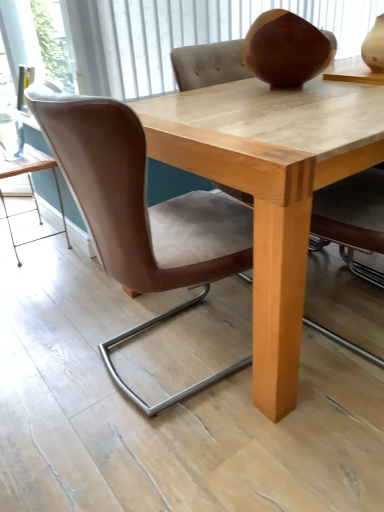
Question: Considering the relative sizes of brown leather chair at center and light brown wood table at lower left in the image provided, is brown leather chair at center thinner than light brown wood table at lower left?

Choices:
 (A) yes
 (B) no

Answer: (B)

Question: Could you tell me if brown leather chair at center is facing light brown wood table at lower left?

Choices:
 (A) yes
 (B) no

Answer: (B)

Question: Can you confirm if brown leather chair at center is shorter than light brown wood table at lower left?

Choices:
 (A) yes
 (B) no

Answer: (B)

Question: From a real-world perspective, is brown leather chair at center below light brown wood table at lower left?

Choices:
 (A) yes
 (B) no

Answer: (B)

Question: Does brown leather chair at center have a greater height compared to light brown wood table at lower left?

Choices:
 (A) yes
 (B) no

Answer: (A)

Question: Considering the positions of light brown wood table at lower left and transparent glass door at upper left in the image, is light brown wood table at lower left taller or shorter than transparent glass door at upper left?

Choices:
 (A) tall
 (B) short

Answer: (A)

Question: From a real-world perspective, relative to transparent glass door at upper left, is light brown wood table at lower left vertically above or below?

Choices:
 (A) below
 (B) above

Answer: (A)

Question: Is light brown wood table at lower left in front of or behind transparent glass door at upper left in the image?

Choices:
 (A) front
 (B) behind

Answer: (B)

Question: In terms of width, does light brown wood table at lower left look wider or thinner when compared to transparent glass door at upper left?

Choices:
 (A) thin
 (B) wide

Answer: (B)

Question: Considering their positions, is brown leather chair at center located in front of or behind transparent glass door at upper left?

Choices:
 (A) behind
 (B) front

Answer: (B)

Question: Do you think brown leather chair at center is within transparent glass door at upper left, or outside of it?

Choices:
 (A) inside
 (B) outside

Answer: (B)

Question: From a real-world perspective, is brown leather chair at center positioned above or below transparent glass door at upper left?

Choices:
 (A) below
 (B) above

Answer: (A)

Question: From the image's perspective, relative to transparent glass door at upper left, is brown leather chair at center above or below?

Choices:
 (A) below
 (B) above

Answer: (A)

Question: In terms of height, does transparent glass door at upper left look taller or shorter compared to light brown wood table at lower left?

Choices:
 (A) tall
 (B) short

Answer: (B)

Question: In terms of width, does transparent glass door at upper left look wider or thinner when compared to light brown wood table at lower left?

Choices:
 (A) thin
 (B) wide

Answer: (A)